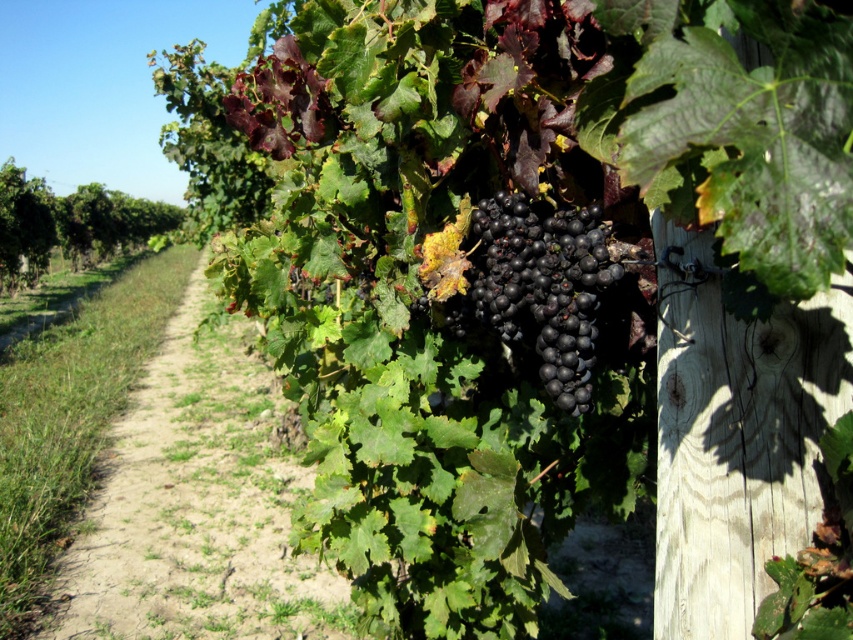
Is dirt path at center thinner than shiny black grapes at center?

No, dirt path at center is not thinner than shiny black grapes at center.

How distant is dirt path at center from shiny black grapes at center?

dirt path at center is 3.72 meters away from shiny black grapes at center.

Which is behind, point (238, 369) or point (572, 234)?

The point (238, 369) is more distant.

Where is `dirt path at center`? This screenshot has height=640, width=853. dirt path at center is located at coordinates (198, 502).